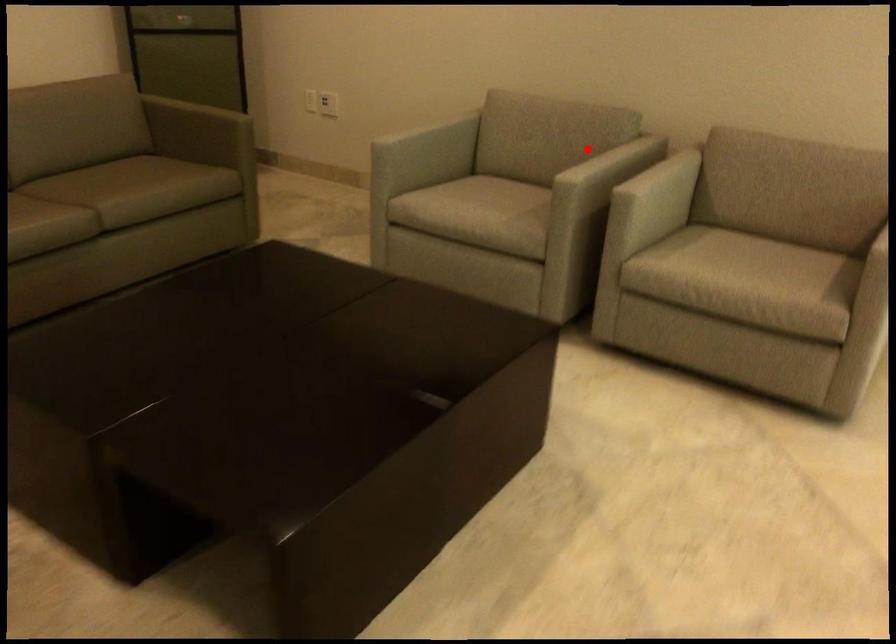
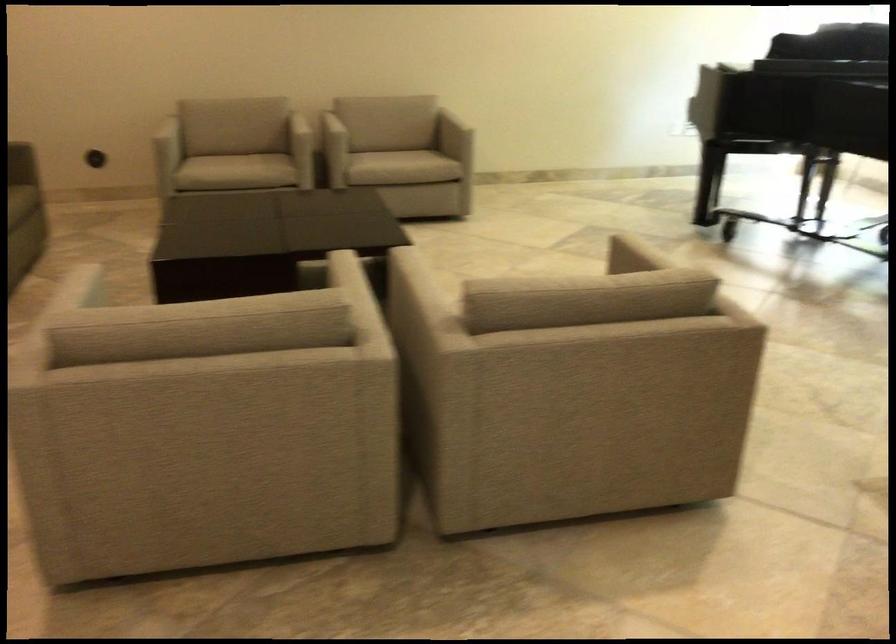
Find the pixel in the second image that matches the highlighted location in the first image.

(271, 117)